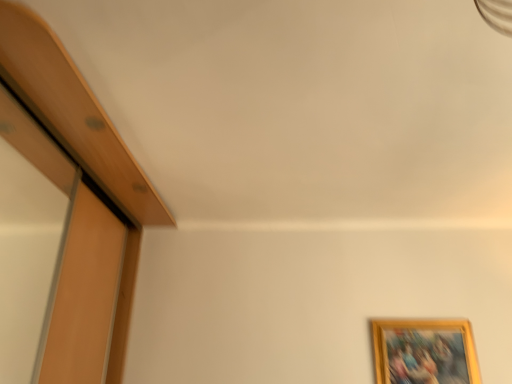
Find the location of a particular element. gold wooden picture frame at lower right is located at coordinates (424, 352).

Describe the element at coordinates (424, 352) in the screenshot. I see `gold wooden picture frame at lower right` at that location.

Identify the location of gold wooden picture frame at lower right. The height and width of the screenshot is (384, 512). (424, 352).